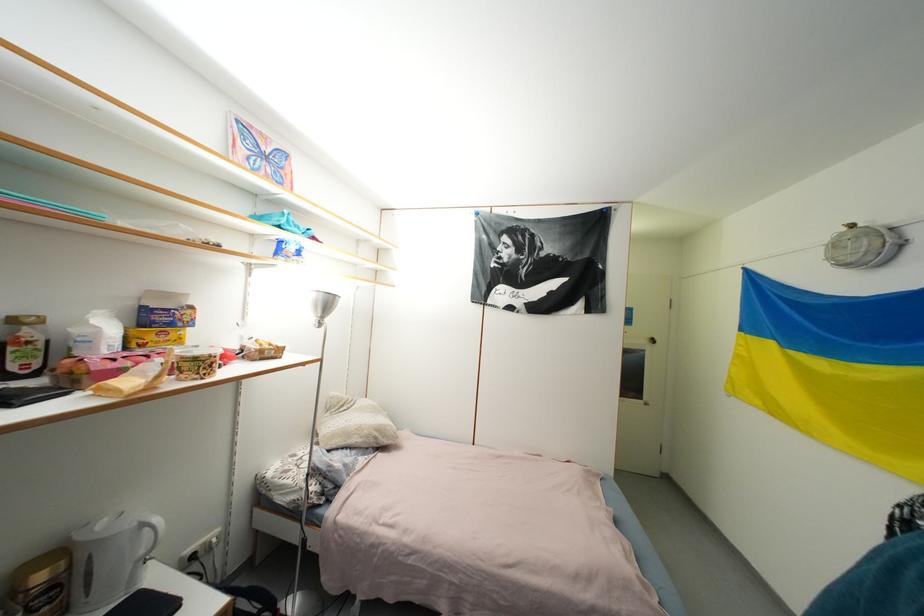
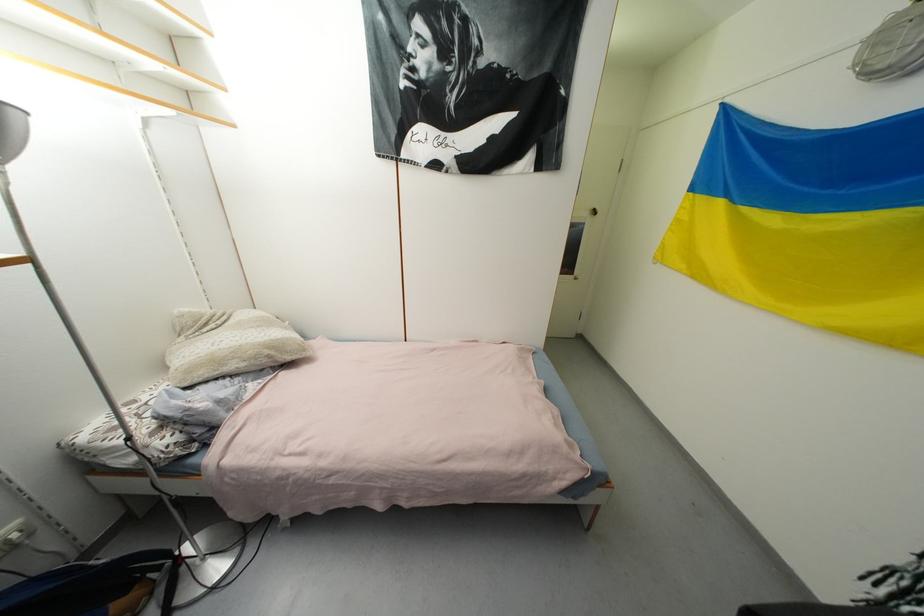
Where in the second image is the point corresponding to the point at 372,438 from the first image?

(261, 359)